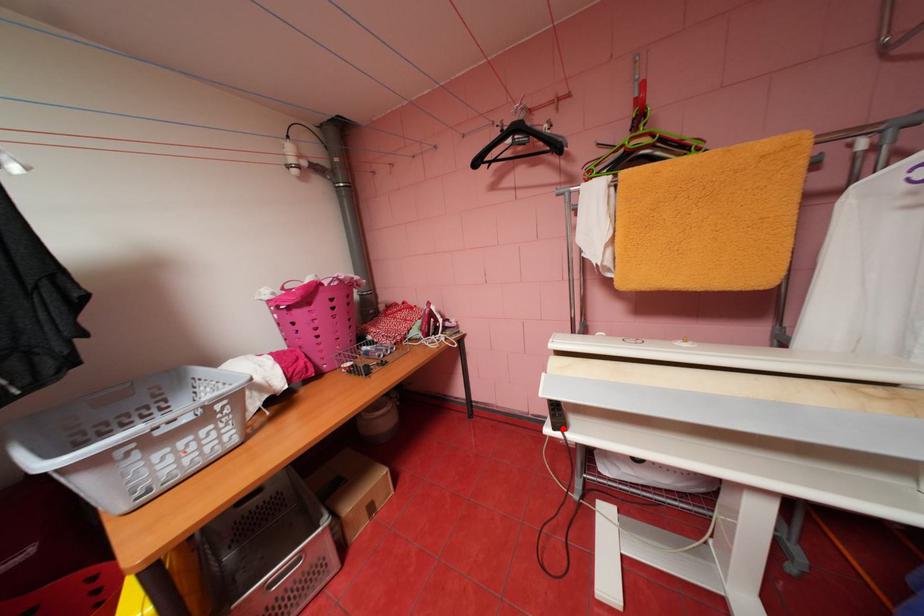
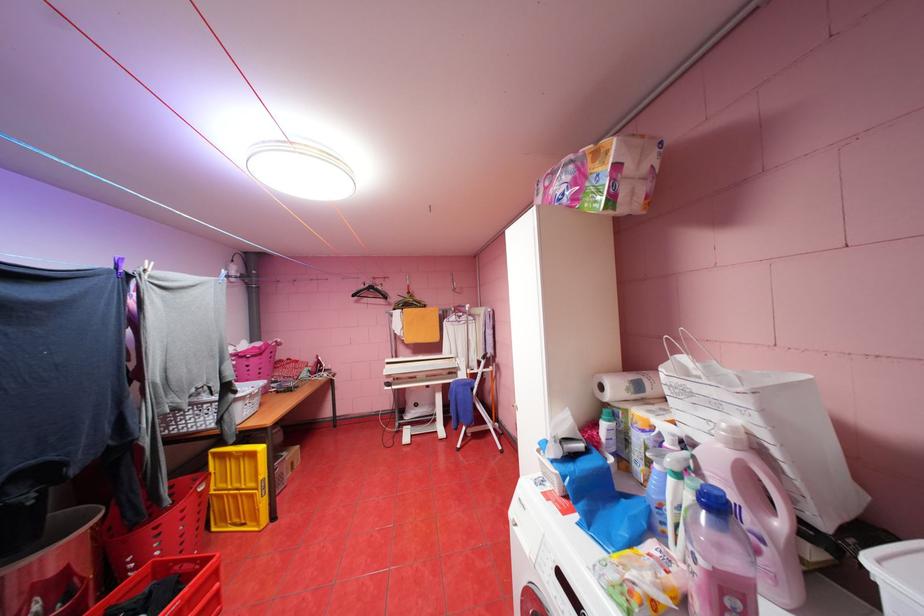
Where in the second image is the point corresponding to the highlighted location from the first image?

(396, 387)